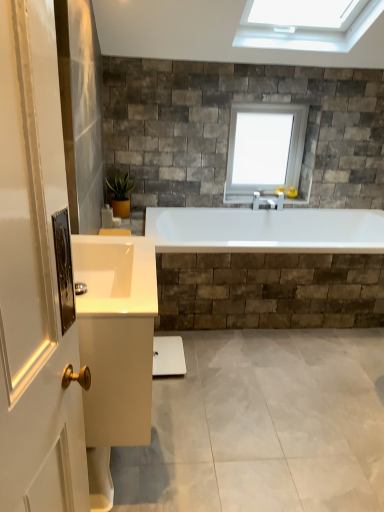
What are the coordinates of `white glossy sink at lower left` in the screenshot? It's located at (115, 275).

The width and height of the screenshot is (384, 512). I want to click on white glass window at upper center, so click(x=264, y=149).

What is the approximate height of white glass window at upper center?

69.57 centimeters.

The image size is (384, 512). Find the location of `green matte plant at upper left`. green matte plant at upper left is located at coordinates (120, 187).

The image size is (384, 512). I want to click on white glossy sink at lower left, so click(x=115, y=275).

Does green matte plant at upper left lie in front of white glossy sink at lower left?

No, green matte plant at upper left is further to the viewer.

In the scene shown: From the image's perspective, which one is positioned higher, green matte plant at upper left or white glossy sink at lower left?

green matte plant at upper left is shown above in the image.

Can you confirm if green matte plant at upper left is smaller than white glossy sink at lower left?

Yes, green matte plant at upper left is smaller than white glossy sink at lower left.

Which is more to the right, green matte plant at upper left or white glossy sink at lower left?

Positioned to the right is white glossy sink at lower left.

Considering the positions of point (124, 258) and point (260, 190), is point (124, 258) closer or farther from the camera than point (260, 190)?

Clearly, point (124, 258) is closer to the camera than point (260, 190).

Find the location of `vanity located on the left of white glass window at upper center`. vanity located on the left of white glass window at upper center is located at coordinates (115, 348).

Would you say white glossy cabinet at lower left is to the left or to the right of white glass window at upper center in the picture?

white glossy cabinet at lower left is positioned on white glass window at upper center's left side.

From a real-world perspective, which object rests below the other?

white glossy cabinet at lower left.

Looking at this image, is white glossy sink at lower left at the left side of white glossy cabinet at lower left?

In fact, white glossy sink at lower left is to the right of white glossy cabinet at lower left.

At what (x,y) coordinates should I click in order to perform the action: click on vanity below the white glossy sink at lower left (from a real-world perspective). Please return your answer as a coordinate pair (x, y). Looking at the image, I should click on [x=115, y=348].

Which is nearer, (265, 111) or (146, 368)?

The point (146, 368) is in front.

From the image's perspective, does white glass window at upper center appear higher than white glossy cabinet at lower left?

Yes, from the image's perspective, white glass window at upper center is on top of white glossy cabinet at lower left.

Is white glass window at upper center at the right side of white glossy cabinet at lower left?

Yes.

Would you say white glossy cabinet at lower left is to the left or to the right of white glossy sink at lower left in the picture?

white glossy cabinet at lower left is to the left of white glossy sink at lower left.

How many degrees apart are the facing directions of white glossy cabinet at lower left and white glossy sink at lower left?

They differ by 0.000653 degrees in their facing directions.

From the image's perspective, between white glossy cabinet at lower left and white glossy sink at lower left, which one is located above?

white glossy sink at lower left appears higher in the image.

Which is farther from the camera, (154,313) or (83,302)?

The point (154,313) is farther.

Considering the relative sizes of white glossy sink at lower left and white glass window at upper center in the image provided, is white glossy sink at lower left bigger than white glass window at upper center?

No, white glossy sink at lower left is not bigger than white glass window at upper center.

Is white glossy sink at lower left oriented away from white glass window at upper center?

No, white glossy sink at lower left's orientation is not away from white glass window at upper center.

Identify the location of sink that appears below the white glass window at upper center (from the image's perspective). This screenshot has height=512, width=384. (115, 275).

Consider the image. From a real-world perspective, which is physically below, white glossy sink at lower left or white glass window at upper center?

In real-world perspective, white glossy sink at lower left is lower.

Is green matte plant at upper left bigger than white glass window at upper center?

Incorrect, green matte plant at upper left is not larger than white glass window at upper center.

Is green matte plant at upper left wider or thinner than white glass window at upper center?

Considering their sizes, green matte plant at upper left looks broader than white glass window at upper center.

From the image's perspective, relative to white glass window at upper center, is green matte plant at upper left above or below?

Based on their image positions, green matte plant at upper left is located beneath white glass window at upper center.

Locate an element on the screen. The image size is (384, 512). sink below the green matte plant at upper left (from the image's perspective) is located at coordinates (115, 275).

Locate an element on the screen. window that appears behind the white glossy cabinet at lower left is located at coordinates (264, 149).

Which object lies nearer to the anchor point white glass window at upper center, white glossy cabinet at lower left or green matte plant at upper left?

green matte plant at upper left is positioned closer to the anchor white glass window at upper center.

Based on their spatial positions, is white glossy cabinet at lower left or white glass window at upper center further from green matte plant at upper left?

white glossy cabinet at lower left is further to green matte plant at upper left.

Looking at this image, looking at the image, which one is located closer to green matte plant at upper left, white glossy sink at lower left or white glass window at upper center?

white glass window at upper center is closer to green matte plant at upper left.

From the picture: When comparing their distances from white glass window at upper center, does green matte plant at upper left or white glossy cabinet at lower left seem closer?

Based on the image, green matte plant at upper left appears to be nearer to white glass window at upper center.

Estimate the real-world distances between objects in this image. Which object is further from white glossy sink at lower left, green matte plant at upper left or white glossy cabinet at lower left?

Based on the image, green matte plant at upper left appears to be further to white glossy sink at lower left.

Looking at the image, which one is located further to green matte plant at upper left, white glass window at upper center or white glossy sink at lower left?

Among the two, white glossy sink at lower left is located further to green matte plant at upper left.

When comparing their distances from white glass window at upper center, does white glossy sink at lower left or green matte plant at upper left seem further?

white glossy sink at lower left is further to white glass window at upper center.

Considering their positions, is white glossy cabinet at lower left positioned further to white glass window at upper center than white glossy sink at lower left?

white glossy cabinet at lower left is positioned further to the anchor white glass window at upper center.

At what (x,y) coordinates should I click in order to perform the action: click on plant located between white glossy sink at lower left and white glass window at upper center in the depth direction. Please return your answer as a coordinate pair (x, y). This screenshot has height=512, width=384. Looking at the image, I should click on (120, 187).

Locate an element on the screen. Image resolution: width=384 pixels, height=512 pixels. vanity positioned between white glossy sink at lower left and white glass window at upper center from near to far is located at coordinates (115, 348).

Find the location of a particular element. vanity between white glossy sink at lower left and green matte plant at upper left along the z-axis is located at coordinates (115, 348).

Find the location of `plant located between white glossy cabinet at lower left and white glass window at upper center in the depth direction`. plant located between white glossy cabinet at lower left and white glass window at upper center in the depth direction is located at coordinates (120, 187).